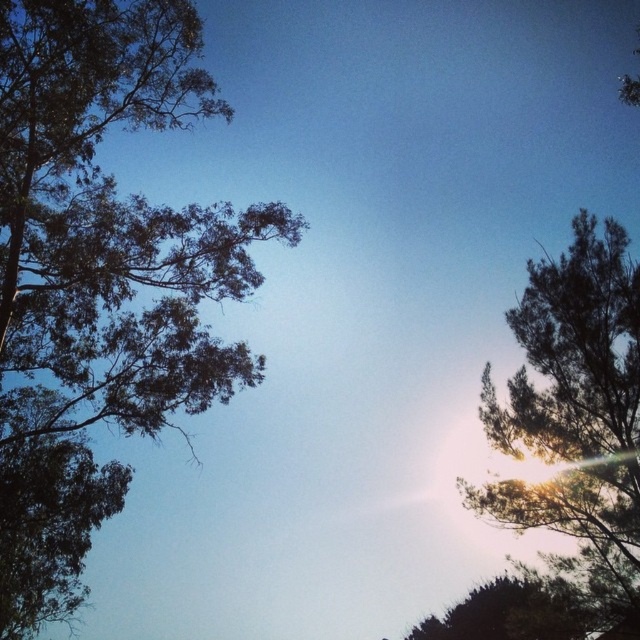
Between green leafy tree at upper left and dark green leafy tree at upper right, which one is positioned higher?

green leafy tree at upper left is higher up.

Does point (152, 400) come behind point (605, 332)?

No, (152, 400) is closer to viewer.

The height and width of the screenshot is (640, 640). In order to click on green leafy tree at upper left in this screenshot , I will do `click(109, 224)`.

Find the location of a particular element. This screenshot has height=640, width=640. green leafy tree at upper left is located at coordinates (109, 224).